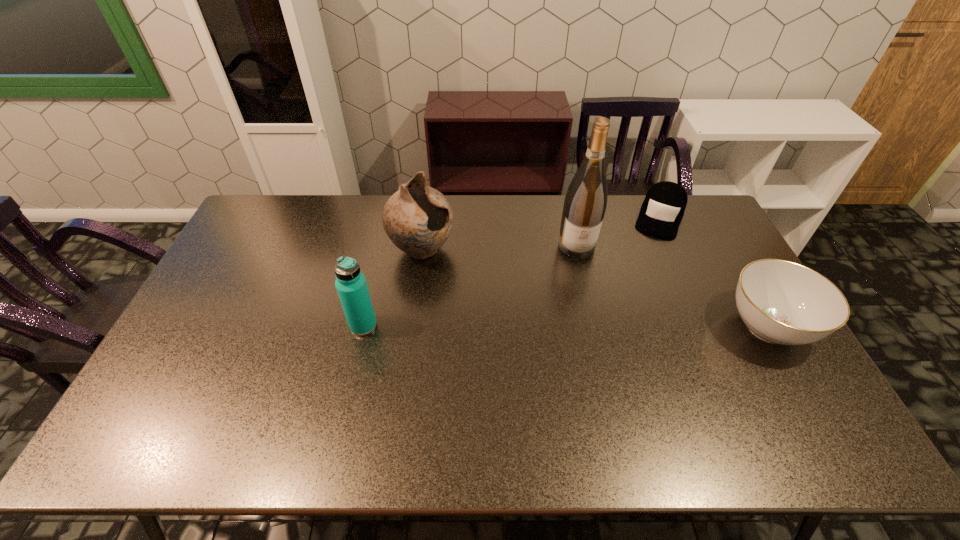
The height and width of the screenshot is (540, 960). What are the coordinates of `the third tallest object` in the screenshot? It's located at (351, 286).

Where is `chinaware`? chinaware is located at coordinates (782, 302).

The width and height of the screenshot is (960, 540). In order to click on the third object from right to left in this screenshot , I will do `click(585, 203)`.

Identify the location of the tallest object. The width and height of the screenshot is (960, 540). (585, 203).

In order to click on pottery in this screenshot , I will do `click(418, 219)`.

I want to click on the shortest object, so click(662, 210).

Locate an element on the screen. vacant space situated on the back of the third tallest object is located at coordinates (370, 300).

Where is `vacant region located on the back of the chinaware`? The width and height of the screenshot is (960, 540). vacant region located on the back of the chinaware is located at coordinates (716, 236).

Find the location of a particular element. Image resolution: width=960 pixels, height=540 pixels. vacant space situated 0.100m on the label of the third object from left to right is located at coordinates (583, 281).

Where is `free spot located 0.260m on the label of the third object from left to right`? Image resolution: width=960 pixels, height=540 pixels. free spot located 0.260m on the label of the third object from left to right is located at coordinates (589, 321).